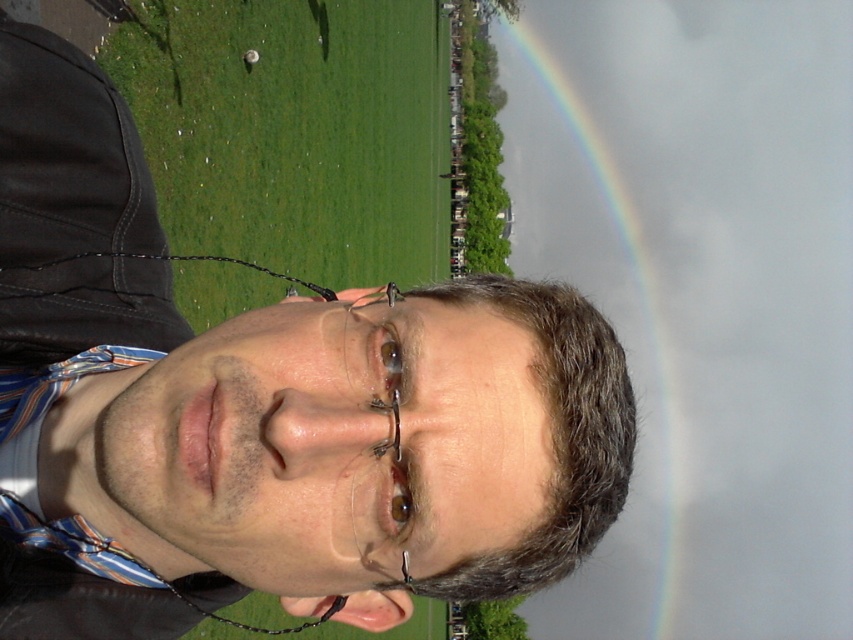
What do you see at coordinates (267, 406) in the screenshot? The image size is (853, 640). I see `matte black jacket at center` at bounding box center [267, 406].

Between point (339, 516) and point (614, 252), which one is positioned in front?

Positioned in front is point (339, 516).

Does point (164, 602) come closer to viewer compared to point (685, 244)?

Yes, point (164, 602) is in front of point (685, 244).

This screenshot has width=853, height=640. Find the location of `matte black jacket at center`. matte black jacket at center is located at coordinates (267, 406).